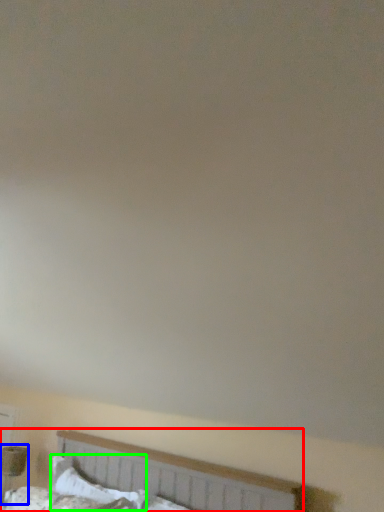
Question: Which object is the farthest from bed (highlighted by a red box)? Choose among these: table lamp (highlighted by a blue box) or pillow (highlighted by a green box).

Choices:
 (A) table lamp
 (B) pillow

Answer: (A)